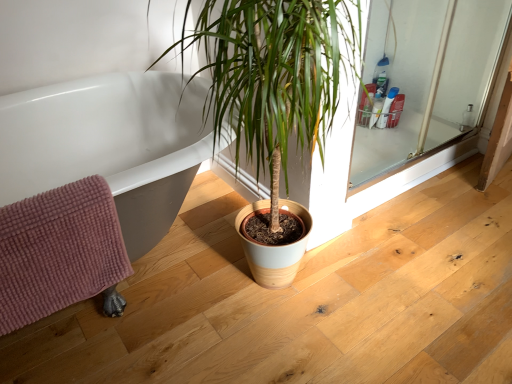
What do you see at coordinates (58, 251) in the screenshot?
I see `pink textured bath towel at lower left` at bounding box center [58, 251].

Measure the distance between pink textured bath towel at lower left and camera.

The depth of pink textured bath towel at lower left is 32.20 inches.

Find the location of a particular element. The width and height of the screenshot is (512, 384). pink textured bath towel at lower left is located at coordinates (58, 251).

The image size is (512, 384). I want to click on clear glass screen door at upper right, so click(x=425, y=79).

What do you see at coordinates (425, 79) in the screenshot? Image resolution: width=512 pixels, height=384 pixels. I see `clear glass screen door at upper right` at bounding box center [425, 79].

Locate an element on the screen. The width and height of the screenshot is (512, 384). pink textured bath towel at lower left is located at coordinates (58, 251).

Considering the positions of objects clear glass screen door at upper right and pink textured bath towel at lower left in the image provided, who is more to the right, clear glass screen door at upper right or pink textured bath towel at lower left?

clear glass screen door at upper right.

Considering the relative positions of clear glass screen door at upper right and pink textured bath towel at lower left in the image provided, is clear glass screen door at upper right in front of pink textured bath towel at lower left?

No, it is behind pink textured bath towel at lower left.

Considering the points (362, 171) and (18, 271), which point is in front, point (362, 171) or point (18, 271)?

The point (18, 271) is more forward.

From the image's perspective, is clear glass screen door at upper right over pink textured bath towel at lower left?

Yes.

From a real-world perspective, who is located lower, clear glass screen door at upper right or pink textured bath towel at lower left?

clear glass screen door at upper right, from a real-world perspective.

Can you confirm if clear glass screen door at upper right is wider than pink textured bath towel at lower left?

No, clear glass screen door at upper right is not wider than pink textured bath towel at lower left.

Does clear glass screen door at upper right have a greater height compared to pink textured bath towel at lower left?

Yes.

Considering the sizes of objects clear glass screen door at upper right and pink textured bath towel at lower left in the image provided, who is smaller, clear glass screen door at upper right or pink textured bath towel at lower left?

pink textured bath towel at lower left is smaller.

Is pink textured bath towel at lower left a part of clear glass screen door at upper right?

No, pink textured bath towel at lower left is not surrounded by clear glass screen door at upper right.

Looking at this image, can you see clear glass screen door at upper right touching pink textured bath towel at lower left?

No, clear glass screen door at upper right is not touching pink textured bath towel at lower left.

Is pink textured bath towel at lower left at the back of clear glass screen door at upper right?

No, clear glass screen door at upper right's orientation is not away from pink textured bath towel at lower left.

How many degrees apart are the facing directions of clear glass screen door at upper right and pink textured bath towel at lower left?

There is a 1.83-degree angle between the facing directions of clear glass screen door at upper right and pink textured bath towel at lower left.

Find the location of a particular element. bath towel on the left of clear glass screen door at upper right is located at coordinates (58, 251).

Between pink textured bath towel at lower left and clear glass screen door at upper right, which one appears on the left side from the viewer's perspective?

pink textured bath towel at lower left is more to the left.

Is the position of pink textured bath towel at lower left more distant than that of clear glass screen door at upper right?

No, it is in front of clear glass screen door at upper right.

Is point (23, 232) positioned before point (417, 143)?

Yes, point (23, 232) is in front of point (417, 143).

From the image's perspective, who appears lower, pink textured bath towel at lower left or clear glass screen door at upper right?

pink textured bath towel at lower left is shown below in the image.

From a real-world perspective, is pink textured bath towel at lower left over clear glass screen door at upper right?

Yes.

Which of these two, pink textured bath towel at lower left or clear glass screen door at upper right, is wider?

pink textured bath towel at lower left.

Considering the sizes of objects pink textured bath towel at lower left and clear glass screen door at upper right in the image provided, who is shorter, pink textured bath towel at lower left or clear glass screen door at upper right?

Standing shorter between the two is pink textured bath towel at lower left.

Considering the sizes of objects pink textured bath towel at lower left and clear glass screen door at upper right in the image provided, who is bigger, pink textured bath towel at lower left or clear glass screen door at upper right?

clear glass screen door at upper right.

Choose the correct answer: Is pink textured bath towel at lower left inside clear glass screen door at upper right or outside it?

pink textured bath towel at lower left is located beyond the bounds of clear glass screen door at upper right.

Can you see pink textured bath towel at lower left touching clear glass screen door at upper right?

No, pink textured bath towel at lower left is not touching clear glass screen door at upper right.

Is pink textured bath towel at lower left aimed at clear glass screen door at upper right?

No, pink textured bath towel at lower left does not turn towards clear glass screen door at upper right.

How different are the orientations of pink textured bath towel at lower left and clear glass screen door at upper right in degrees?

The facing directions of pink textured bath towel at lower left and clear glass screen door at upper right are 1.83 degrees apart.

You are a GUI agent. You are given a task and a screenshot of the screen. Output one action in this format:
    pyautogui.click(x=<x>, y=<y>)
    Task: Click on the bath towel located on the left of clear glass screen door at upper right
    The image size is (512, 384).
    Given the screenshot: What is the action you would take?
    pyautogui.click(x=58, y=251)

Locate an element on the screen. The image size is (512, 384). bath towel on the left of clear glass screen door at upper right is located at coordinates (58, 251).

Image resolution: width=512 pixels, height=384 pixels. Identify the location of bath towel below the clear glass screen door at upper right (from the image's perspective). (58, 251).